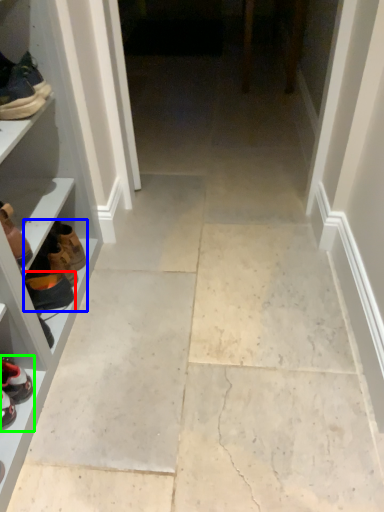
Question: Estimate the real-world distances between objects in this image. Which object is farther from footwear (highlighted by a red box), shoe (highlighted by a blue box) or footwear (highlighted by a green box)?

Choices:
 (A) shoe
 (B) footwear

Answer: (B)